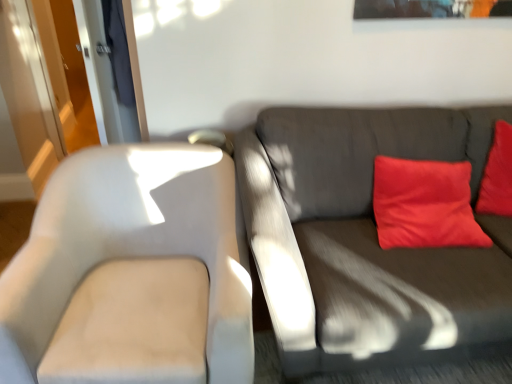
Question: From the image's perspective, is matte red pillow at upper right located above transparent glass door at upper left?

Choices:
 (A) no
 (B) yes

Answer: (A)

Question: Does matte red pillow at upper right turn towards transparent glass door at upper left?

Choices:
 (A) no
 (B) yes

Answer: (A)

Question: Is matte red pillow at upper right completely or partially outside of transparent glass door at upper left?

Choices:
 (A) no
 (B) yes

Answer: (B)

Question: Is matte red pillow at upper right turned away from transparent glass door at upper left?

Choices:
 (A) no
 (B) yes

Answer: (A)

Question: From the image's perspective, is matte red pillow at upper right beneath transparent glass door at upper left?

Choices:
 (A) no
 (B) yes

Answer: (B)

Question: Considering the relative sizes of matte red pillow at upper right and transparent glass door at upper left in the image provided, is matte red pillow at upper right wider than transparent glass door at upper left?

Choices:
 (A) no
 (B) yes

Answer: (B)

Question: Could matte red pillow at upper right be considered to be inside dark gray fabric couch at right?

Choices:
 (A) no
 (B) yes

Answer: (B)

Question: From a real-world perspective, is dark gray fabric couch at right physically above matte red pillow at upper right?

Choices:
 (A) no
 (B) yes

Answer: (A)

Question: Is dark gray fabric couch at right not within matte red pillow at upper right?

Choices:
 (A) no
 (B) yes

Answer: (B)

Question: Considering the relative sizes of dark gray fabric couch at right and matte red pillow at upper right in the image provided, is dark gray fabric couch at right shorter than matte red pillow at upper right?

Choices:
 (A) no
 (B) yes

Answer: (A)

Question: Does dark gray fabric couch at right lie in front of matte red pillow at upper right?

Choices:
 (A) yes
 (B) no

Answer: (A)

Question: Can you confirm if dark gray fabric couch at right is wider than matte red pillow at upper right?

Choices:
 (A) yes
 (B) no

Answer: (A)

Question: Is matte red pillow at upper right facing towards dark gray fabric couch at right?

Choices:
 (A) no
 (B) yes

Answer: (B)